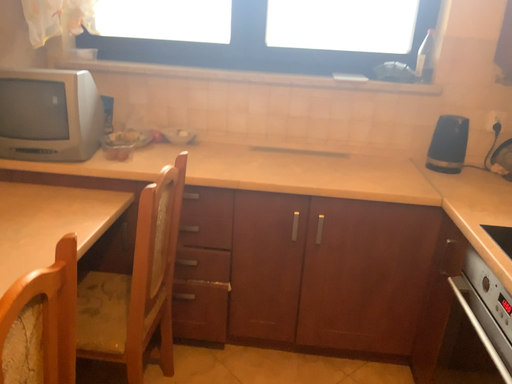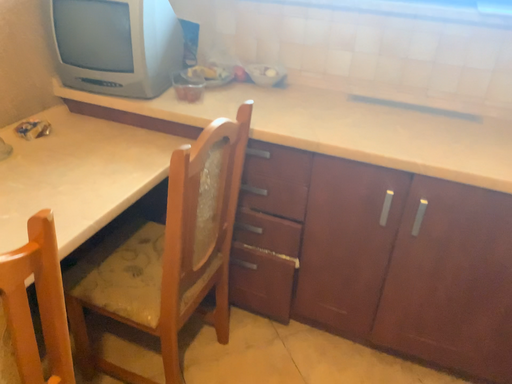
Question: How did the camera likely rotate when shooting the video?

Choices:
 (A) rotated downward
 (B) rotated upward

Answer: (A)